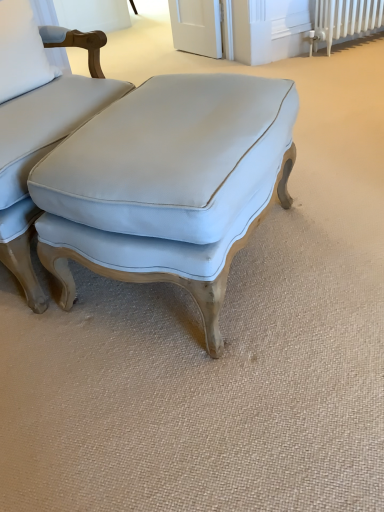
The image size is (384, 512). What do you see at coordinates (344, 20) in the screenshot? I see `white painted metal radiator at upper right` at bounding box center [344, 20].

In the scene shown: Measure the distance between point (37, 144) and camera.

1.10 meters.

What do you see at coordinates (21, 51) in the screenshot? I see `white fabric pillow at upper left` at bounding box center [21, 51].

In order to face white fabric pillow at upper left, should I rotate leftwards or rightwards?

Rotate left and turn 22.785 degrees.

The image size is (384, 512). What do you see at coordinates (168, 185) in the screenshot?
I see `light blue fabric ottoman at center` at bounding box center [168, 185].

What are the coordinates of `white painted metal radiator at upper right` in the screenshot? It's located at (344, 20).

Considering the relative sizes of light blue fabric ottoman at center and white painted metal radiator at upper right in the image provided, is light blue fabric ottoman at center taller than white painted metal radiator at upper right?

Yes.

How many degrees apart are the facing directions of light blue fabric ottoman at center and white painted metal radiator at upper right?

The angle between the facing direction of light blue fabric ottoman at center and the facing direction of white painted metal radiator at upper right is 142 degrees.

From the picture: From a real-world perspective, is light blue fabric ottoman at center located higher than white painted metal radiator at upper right?

Yes, from a real-world perspective, light blue fabric ottoman at center is above white painted metal radiator at upper right.

Can you confirm if light blue fabric ottoman at center is positioned to the right of white painted metal radiator at upper right?

In fact, light blue fabric ottoman at center is to the left of white painted metal radiator at upper right.

Considering the sizes of objects matte white cushion at center and white painted metal radiator at upper right in the image provided, who is shorter, matte white cushion at center or white painted metal radiator at upper right?

white painted metal radiator at upper right is shorter.

Does matte white cushion at center touch white painted metal radiator at upper right?

No, matte white cushion at center is not in contact with white painted metal radiator at upper right.

Considering the relative sizes of matte white cushion at center and white painted metal radiator at upper right in the image provided, is matte white cushion at center wider than white painted metal radiator at upper right?

Correct, the width of matte white cushion at center exceeds that of white painted metal radiator at upper right.

Visually, is matte white cushion at center positioned to the left or to the right of white painted metal radiator at upper right?

matte white cushion at center is positioned on white painted metal radiator at upper right's left side.

At what (x,y) coordinates should I click in order to perform the action: click on radiator on the right of white fabric pillow at upper left. Please return your answer as a coordinate pair (x, y). Looking at the image, I should click on (344, 20).

Considering the relative sizes of white painted metal radiator at upper right and white fabric pillow at upper left in the image provided, is white painted metal radiator at upper right taller than white fabric pillow at upper left?

No.

How different are the orientations of white painted metal radiator at upper right and white fabric pillow at upper left in degrees?

The angle between the facing direction of white painted metal radiator at upper right and the facing direction of white fabric pillow at upper left is 31.7 degrees.

Which is closer to the camera, [332,18] or [22,79]?

Point [332,18] is positioned farther from the camera compared to point [22,79].

From the image's perspective, which is above, light blue fabric ottoman at center or white fabric pillow at upper left?

From the image's view, white fabric pillow at upper left is above.

Between light blue fabric ottoman at center and white fabric pillow at upper left, which one has less height?

With less height is white fabric pillow at upper left.

From the picture: Which object is thinner, light blue fabric ottoman at center or white fabric pillow at upper left?

With smaller width is white fabric pillow at upper left.

You are a GUI agent. You are given a task and a screenshot of the screen. Output one action in this format:
    pyautogui.click(x=<x>, y=<y>)
    Task: Click on the chair that is under the white fabric pillow at upper left (from a real-world perspective)
    The height and width of the screenshot is (512, 384).
    Given the screenshot: What is the action you would take?
    pyautogui.click(x=38, y=123)

Is point (9, 45) closer or farther from the camera than point (31, 226)?

Point (9, 45) appears to be farther away from the viewer than point (31, 226).

Consider the image. Which is in front, white fabric pillow at upper left or matte white cushion at center?

Positioned in front is matte white cushion at center.

Does white painted metal radiator at upper right have a greater width compared to matte white cushion at center?

Incorrect, the width of white painted metal radiator at upper right does not surpass that of matte white cushion at center.

Does white painted metal radiator at upper right turn towards matte white cushion at center?

No, white painted metal radiator at upper right is not facing towards matte white cushion at center.

How many degrees apart are the facing directions of white painted metal radiator at upper right and matte white cushion at center?

white painted metal radiator at upper right and matte white cushion at center are facing 35.5 degrees away from each other.

Does white painted metal radiator at upper right have a greater height compared to matte white cushion at center?

Incorrect, the height of white painted metal radiator at upper right is not larger of that of matte white cushion at center.

From the image's perspective, which one is positioned higher, light blue fabric ottoman at center or matte white cushion at center?

matte white cushion at center.

Is light blue fabric ottoman at center thinner than matte white cushion at center?

Indeed, light blue fabric ottoman at center has a lesser width compared to matte white cushion at center.

Considering their positions, is light blue fabric ottoman at center located in front of or behind matte white cushion at center?

Visually, light blue fabric ottoman at center is located in front of matte white cushion at center.

From a real-world perspective, between light blue fabric ottoman at center and matte white cushion at center, who is vertically lower?

light blue fabric ottoman at center is physically lower.

The image size is (384, 512). What are the coordinates of `studio couch above the white painted metal radiator at upper right (from a real-world perspective)` in the screenshot? It's located at (168, 185).

Identify the location of radiator located behind the matte white cushion at center. click(x=344, y=20).

Looking at this image, when comparing their distances from matte white cushion at center, does light blue fabric ottoman at center or white painted metal radiator at upper right seem further?

Based on the image, white painted metal radiator at upper right appears to be further to matte white cushion at center.

From the image, which object appears to be farther from light blue fabric ottoman at center, white fabric pillow at upper left or white painted metal radiator at upper right?

white painted metal radiator at upper right is further to light blue fabric ottoman at center.

Looking at the image, which one is located closer to white fabric pillow at upper left, matte white cushion at center or light blue fabric ottoman at center?

The object closer to white fabric pillow at upper left is matte white cushion at center.

In the scene shown: Considering their positions, is matte white cushion at center positioned further to white fabric pillow at upper left than white painted metal radiator at upper right?

The object further to white fabric pillow at upper left is white painted metal radiator at upper right.

From the image, which object appears to be farther from white painted metal radiator at upper right, white fabric pillow at upper left or matte white cushion at center?

white fabric pillow at upper left.

Estimate the real-world distances between objects in this image. Which object is closer to matte white cushion at center, white painted metal radiator at upper right or light blue fabric ottoman at center?

The object closer to matte white cushion at center is light blue fabric ottoman at center.

Estimate the real-world distances between objects in this image. Which object is further from light blue fabric ottoman at center, white painted metal radiator at upper right or matte white cushion at center?

white painted metal radiator at upper right lies further to light blue fabric ottoman at center than the other object.

From the image, which object appears to be farther from white fabric pillow at upper left, white painted metal radiator at upper right or matte white cushion at center?

The object further to white fabric pillow at upper left is white painted metal radiator at upper right.

This screenshot has height=512, width=384. Find the location of `pillow between light blue fabric ottoman at center and white painted metal radiator at upper right from front to back`. pillow between light blue fabric ottoman at center and white painted metal radiator at upper right from front to back is located at coordinates (21, 51).

In order to click on pillow between matte white cushion at center and white painted metal radiator at upper right in the front-back direction in this screenshot , I will do `click(21, 51)`.

At what (x,y) coordinates should I click in order to perform the action: click on chair between light blue fabric ottoman at center and white painted metal radiator at upper right from front to back. Please return your answer as a coordinate pair (x, y). Looking at the image, I should click on (38, 123).

The height and width of the screenshot is (512, 384). Find the location of `pillow located between matte white cushion at center and light blue fabric ottoman at center in the left-right direction`. pillow located between matte white cushion at center and light blue fabric ottoman at center in the left-right direction is located at coordinates (21, 51).